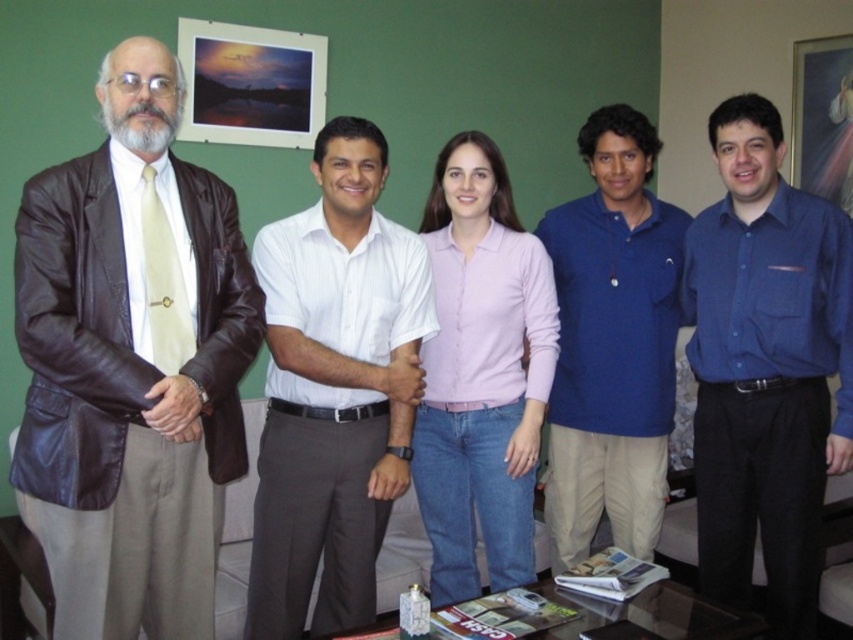
You are standing in the office and want to move from point A to point B. Point A is at coordinate point(357, 241) and point B is at coordinate point(738, 99). Can you walk directly from point A to point B without any obstacles?

Point(357, 241) is in front of point(738, 99), so you can walk directly from point A to point B without any obstacles because there are no objects blocking the path between them.